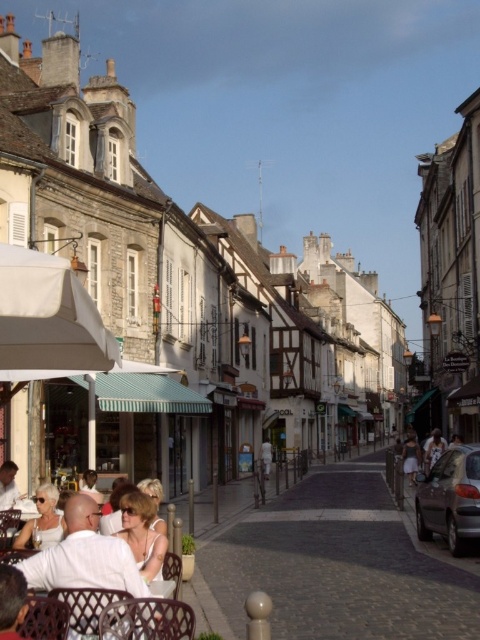
Is point (404, 452) in front of point (433, 433)?

No.

Does dark gray fabric dress at center appear over white cotton shirt at right?

Incorrect, dark gray fabric dress at center is not positioned above white cotton shirt at right.

The width and height of the screenshot is (480, 640). I want to click on dark gray fabric dress at center, so click(x=410, y=458).

Does white fabric umbrella at lower left have a greater height compared to white fabric sunglasses at center?

Yes, white fabric umbrella at lower left is taller than white fabric sunglasses at center.

The image size is (480, 640). I want to click on white fabric umbrella at lower left, so click(48, 320).

This screenshot has height=640, width=480. In order to click on white fabric umbrella at lower left in this screenshot , I will do `click(48, 320)`.

Between white tank top at center and dark gray fabric dress at center, which one has more height?

With more height is white tank top at center.

Does white tank top at center appear on the right side of dark gray fabric dress at center?

Incorrect, white tank top at center is not on the right side of dark gray fabric dress at center.

The image size is (480, 640). What do you see at coordinates (142, 532) in the screenshot? I see `white tank top at center` at bounding box center [142, 532].

Image resolution: width=480 pixels, height=640 pixels. I want to click on white tank top at center, so click(142, 532).